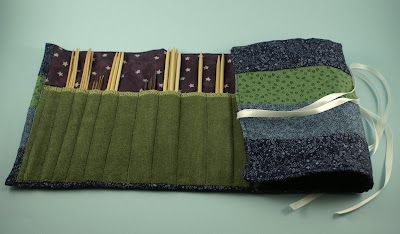
At what (x,y) coordinates should I click in order to perform the action: click on light blue patterned fabric. Please return your answer as a coordinate pair (x, y). The width and height of the screenshot is (400, 234). Looking at the image, I should click on (315, 126).